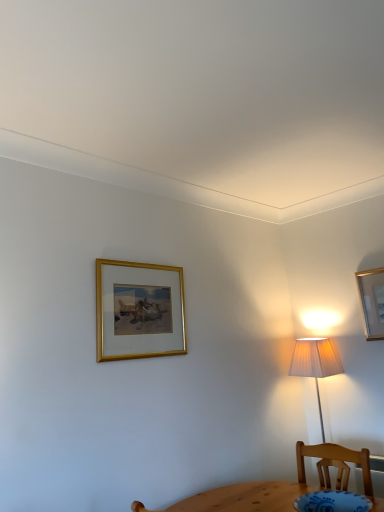
Question: From the image's perspective, is gold-framed painting at upper center, which is the 1th picture frame in left-to-right order, over metallic gold picture frame at upper right, positioned as the 2th picture frame in left-to-right order?

Choices:
 (A) yes
 (B) no

Answer: (A)

Question: From a real-world perspective, is gold-framed painting at upper center, positioned as the first picture frame in front-to-back order, over metallic gold picture frame at upper right, which is counted as the 1th picture frame, starting from the right?

Choices:
 (A) no
 (B) yes

Answer: (B)

Question: Does gold-framed painting at upper center, positioned as the first picture frame in front-to-back order, have a lesser height compared to metallic gold picture frame at upper right, which appears as the 2th picture frame when viewed from the front?

Choices:
 (A) no
 (B) yes

Answer: (A)

Question: Could you tell me if gold-framed painting at upper center, positioned as the first picture frame in front-to-back order, is facing metallic gold picture frame at upper right, which is counted as the 1th picture frame, starting from the right?

Choices:
 (A) yes
 (B) no

Answer: (B)

Question: Is gold-framed painting at upper center, which is counted as the 2th picture frame, starting from the right, looking in the opposite direction of metallic gold picture frame at upper right, which is counted as the 1th picture frame, starting from the right?

Choices:
 (A) no
 (B) yes

Answer: (A)

Question: Is gold-framed painting at upper center, which is the 1th picture frame in left-to-right order, next to metallic gold picture frame at upper right, which appears as the 1th picture frame when viewed from the back, and touching it?

Choices:
 (A) no
 (B) yes

Answer: (A)

Question: Is metallic gold picture frame at upper right, which is counted as the 1th picture frame, starting from the right, not within gold-framed painting at upper center, which is the 1th picture frame in left-to-right order?

Choices:
 (A) no
 (B) yes

Answer: (B)

Question: From a real-world perspective, is metallic gold picture frame at upper right, positioned as the 2th picture frame in left-to-right order, positioned over gold-framed painting at upper center, which is the 1th picture frame in left-to-right order, based on gravity?

Choices:
 (A) no
 (B) yes

Answer: (A)

Question: From a real-world perspective, is metallic gold picture frame at upper right, positioned as the 2th picture frame in left-to-right order, physically below gold-framed painting at upper center, positioned as the second picture frame in back-to-front order?

Choices:
 (A) yes
 (B) no

Answer: (A)

Question: Does metallic gold picture frame at upper right, which is counted as the 1th picture frame, starting from the right, have a greater width compared to gold-framed painting at upper center, positioned as the first picture frame in front-to-back order?

Choices:
 (A) yes
 (B) no

Answer: (B)

Question: Considering the relative sizes of metallic gold picture frame at upper right, which is counted as the 1th picture frame, starting from the right, and gold-framed painting at upper center, which is counted as the 2th picture frame, starting from the right, in the image provided, is metallic gold picture frame at upper right, which is counted as the 1th picture frame, starting from the right, bigger than gold-framed painting at upper center, which is counted as the 2th picture frame, starting from the right,?

Choices:
 (A) yes
 (B) no

Answer: (B)

Question: Is the depth of metallic gold picture frame at upper right, which appears as the 2th picture frame when viewed from the front, less than that of gold-framed painting at upper center, positioned as the second picture frame in back-to-front order?

Choices:
 (A) no
 (B) yes

Answer: (A)

Question: Looking at the image, does metallic gold picture frame at upper right, which is counted as the 1th picture frame, starting from the right, seem bigger or smaller compared to gold-framed painting at upper center, positioned as the second picture frame in back-to-front order?

Choices:
 (A) small
 (B) big

Answer: (A)